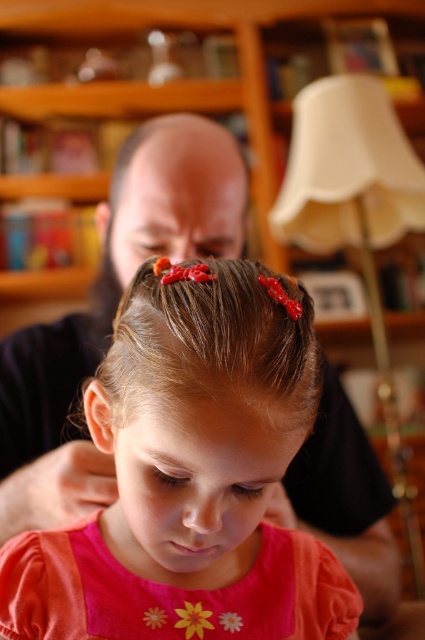
Question: Observing the image, what is the correct spatial positioning of white fabric lampshade at upper right in reference to brown shiny hair at center?

Choices:
 (A) right
 (B) left

Answer: (A)

Question: Which of the following is the closest to the observer?

Choices:
 (A) (410, 218)
 (B) (251, 436)
 (C) (240, 332)

Answer: (C)

Question: Which point is farther from the camera taking this photo?

Choices:
 (A) (257, 337)
 (B) (387, 200)
 (C) (88, 337)

Answer: (B)

Question: Is pink satin dress at center to the left of shiny orange barrette at center from the viewer's perspective?

Choices:
 (A) yes
 (B) no

Answer: (A)

Question: Can you confirm if pink satin dress at center is positioned to the right of shiny orange barrette at center?

Choices:
 (A) no
 (B) yes

Answer: (A)

Question: Which point is closer to the camera?

Choices:
 (A) pink satin dress at center
 (B) white fabric lampshade at upper right
 (C) shiny orange barrette at center
 (D) brown shiny hair at center

Answer: (C)